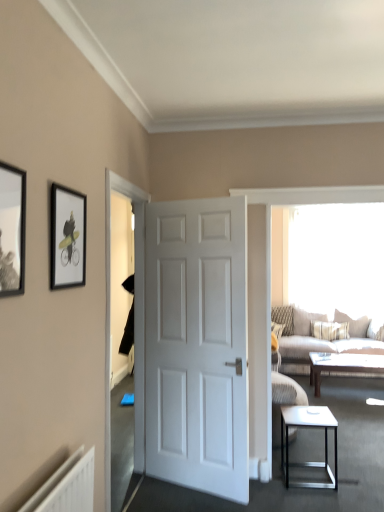
What is the approximate height of matte black picture frame at upper left, which is the 1th picture frame in right-to-left order?

It is 17.47 inches.

Describe the element at coordinates (318, 338) in the screenshot. This screenshot has height=512, width=384. I see `textured beige fabric couch at right` at that location.

Looking at this image, how much space does striped fabric pillow at right, placed as the 1th pillow when sorted from right to left, occupy vertically?

24.23 inches.

The image size is (384, 512). In order to click on matte black picture frame at left, acting as the first picture frame starting from the left in this screenshot , I will do `click(12, 230)`.

Can you tell me how much matte black picture frame at upper left, marked as the second picture frame in a left-to-right arrangement, and patterned fabric pillow at right, acting as the third pillow starting from the right, differ in facing direction?

93.6 degrees.

Between matte black picture frame at upper left, the first picture frame when ordered from back to front, and patterned fabric pillow at right, acting as the first pillow starting from the left, which one appears on the left side from the viewer's perspective?

matte black picture frame at upper left, the first picture frame when ordered from back to front.

Can you confirm if matte black picture frame at upper left, acting as the 2th picture frame starting from the front, is shorter than patterned fabric pillow at right, acting as the third pillow starting from the right?

Yes, matte black picture frame at upper left, acting as the 2th picture frame starting from the front, is shorter than patterned fabric pillow at right, acting as the third pillow starting from the right.

Would you say matte black picture frame at upper left, the first picture frame when ordered from back to front, is a long distance from patterned fabric pillow at right, acting as the first pillow starting from the left?

matte black picture frame at upper left, the first picture frame when ordered from back to front, is far away from patterned fabric pillow at right, acting as the first pillow starting from the left.

Is white glossy side table at lower right positioned far away from beige textured pillow at right, the 2th pillow in the right-to-left sequence?

Yes, white glossy side table at lower right and beige textured pillow at right, the 2th pillow in the right-to-left sequence, are located far from each other.

Between white glossy side table at lower right and beige textured pillow at right, arranged as the second pillow when viewed from the left, which one appears on the right side from the viewer's perspective?

beige textured pillow at right, arranged as the second pillow when viewed from the left.

In terms of height, does white glossy side table at lower right look taller or shorter compared to beige textured pillow at right, the 2th pillow in the right-to-left sequence?

In the image, white glossy side table at lower right appears to be shorter than beige textured pillow at right, the 2th pillow in the right-to-left sequence.

Is the depth of brown wooden coffee table at center greater than that of matte black picture frame at upper left, acting as the 2th picture frame starting from the front?

That is True.

Does brown wooden coffee table at center turn towards matte black picture frame at upper left, the first picture frame when ordered from back to front?

No, brown wooden coffee table at center is not aimed at matte black picture frame at upper left, the first picture frame when ordered from back to front.

In terms of width, does brown wooden coffee table at center look wider or thinner when compared to matte black picture frame at upper left, acting as the 2th picture frame starting from the front?

Considering their sizes, brown wooden coffee table at center looks broader than matte black picture frame at upper left, acting as the 2th picture frame starting from the front.

In the scene shown: Can you tell me how much brown wooden coffee table at center and matte black picture frame at upper left, the first picture frame when ordered from back to front, differ in facing direction?

92.6 degrees.

Is matte black picture frame at left, acting as the first picture frame starting from the left, at the back of beige textured pillow at right, arranged as the second pillow when viewed from the left?

No, matte black picture frame at left, acting as the first picture frame starting from the left, is not at the back of beige textured pillow at right, arranged as the second pillow when viewed from the left.

From a real-world perspective, between beige textured pillow at right, arranged as the second pillow when viewed from the left, and matte black picture frame at left, the second picture frame from the right, who is vertically higher?

matte black picture frame at left, the second picture frame from the right, from a real-world perspective.

Is beige textured pillow at right, arranged as the second pillow when viewed from the left, at the left side of matte black picture frame at left, acting as the first picture frame starting from the left?

In fact, beige textured pillow at right, arranged as the second pillow when viewed from the left, is to the right of matte black picture frame at left, acting as the first picture frame starting from the left.

From the image's perspective, is beige textured pillow at right, the 2th pillow in the right-to-left sequence, positioned above or below matte black picture frame at left, the second picture frame from the right?

Based on their image positions, beige textured pillow at right, the 2th pillow in the right-to-left sequence, is located beneath matte black picture frame at left, the second picture frame from the right.

Is white glossy side table at lower right further to the viewer compared to matte black picture frame at upper left, marked as the second picture frame in a left-to-right arrangement?

Yes, white glossy side table at lower right is further from the viewer.

Does white glossy side table at lower right appear on the left side of matte black picture frame at upper left, the first picture frame when ordered from back to front?

No, white glossy side table at lower right is not to the left of matte black picture frame at upper left, the first picture frame when ordered from back to front.

Does white glossy side table at lower right have a lesser width compared to matte black picture frame at upper left, the first picture frame when ordered from back to front?

In fact, white glossy side table at lower right might be wider than matte black picture frame at upper left, the first picture frame when ordered from back to front.

Who is shorter, white glossy side table at lower right or matte black picture frame at upper left, marked as the second picture frame in a left-to-right arrangement?

Standing shorter between the two is matte black picture frame at upper left, marked as the second picture frame in a left-to-right arrangement.

From the image's perspective, which is above, white glossy side table at lower right or patterned fabric pillow at right, acting as the third pillow starting from the right?

patterned fabric pillow at right, acting as the third pillow starting from the right, appears higher in the image.

Which object is closer to the camera, white glossy side table at lower right or patterned fabric pillow at right, acting as the third pillow starting from the right?

white glossy side table at lower right is in front.

Is point (333, 483) more distant than point (289, 329)?

No, (333, 483) is closer to viewer.

Looking at this image, considering the positions of objects white glossy side table at lower right and patterned fabric pillow at right, acting as the first pillow starting from the left, in the image provided, who is more to the right, white glossy side table at lower right or patterned fabric pillow at right, acting as the first pillow starting from the left,?

Positioned to the right is patterned fabric pillow at right, acting as the first pillow starting from the left.

From the image's perspective, which one is positioned higher, patterned fabric pillow at right, acting as the first pillow starting from the left, or textured beige fabric couch at right?

From the image's view, patterned fabric pillow at right, acting as the first pillow starting from the left, is above.

From a real-world perspective, between patterned fabric pillow at right, acting as the first pillow starting from the left, and textured beige fabric couch at right, who is vertically higher?

patterned fabric pillow at right, acting as the first pillow starting from the left.

In the image, is patterned fabric pillow at right, acting as the third pillow starting from the right, positioned in front of or behind textured beige fabric couch at right?

patterned fabric pillow at right, acting as the third pillow starting from the right, is positioned farther from the viewer than textured beige fabric couch at right.

Locate an element on the screen. The image size is (384, 512). pillow that is the 3rd object located behind the matte black picture frame at upper left, the first picture frame when ordered from back to front is located at coordinates (284, 318).

The height and width of the screenshot is (512, 384). I want to click on table on the left of beige textured pillow at right, the 2th pillow in the right-to-left sequence, so click(x=309, y=426).

Considering their positions, is matte black picture frame at upper left, acting as the 2th picture frame starting from the front, positioned closer to patterned fabric pillow at right, acting as the first pillow starting from the left, than white glossy side table at lower right?

white glossy side table at lower right is positioned closer to the anchor patterned fabric pillow at right, acting as the first pillow starting from the left.

Based on their spatial positions, is striped fabric pillow at right, placed as the 1th pillow when sorted from right to left, or patterned fabric pillow at right, acting as the third pillow starting from the right, further from transparent glass window screen at upper right?

patterned fabric pillow at right, acting as the third pillow starting from the right, is positioned further to the anchor transparent glass window screen at upper right.

Based on their spatial positions, is matte black picture frame at upper left, marked as the second picture frame in a left-to-right arrangement, or textured beige fabric couch at right closer to white glossy side table at lower right?

Among the two, textured beige fabric couch at right is located nearer to white glossy side table at lower right.

Estimate the real-world distances between objects in this image. Which object is further from white glossy door at center, patterned fabric pillow at right, acting as the first pillow starting from the left, or brown wooden coffee table at center?

patterned fabric pillow at right, acting as the first pillow starting from the left.

Considering their positions, is matte black picture frame at upper left, acting as the 2th picture frame starting from the front, positioned further to brown wooden coffee table at center than patterned fabric pillow at right, acting as the third pillow starting from the right?

Among the two, matte black picture frame at upper left, acting as the 2th picture frame starting from the front, is located further to brown wooden coffee table at center.

Looking at the image, which one is located further to brown wooden coffee table at center, striped fabric pillow at right, placed as the 1th pillow when sorted from right to left, or matte black picture frame at left, the second picture frame from the right?

The object further to brown wooden coffee table at center is matte black picture frame at left, the second picture frame from the right.

Based on their spatial positions, is transparent glass window screen at upper right or white glossy door at center closer to matte black picture frame at left, the second picture frame from the right?

white glossy door at center is closer to matte black picture frame at left, the second picture frame from the right.

Based on their spatial positions, is white glossy side table at lower right or striped fabric pillow at right, placed as the 1th pillow when sorted from right to left, closer to matte black picture frame at left, the second picture frame from the right?

white glossy side table at lower right is closer to matte black picture frame at left, the second picture frame from the right.

Find the location of a particular element. studio couch positioned between white glossy side table at lower right and striped fabric pillow at right, the 3th pillow positioned from the left, from near to far is located at coordinates (318, 338).

You are a GUI agent. You are given a task and a screenshot of the screen. Output one action in this format:
    pyautogui.click(x=<x>, y=<y>)
    Task: Click on the studio couch between matte black picture frame at left, the 1th picture frame in the front-to-back sequence, and beige textured pillow at right, the 2th pillow in the right-to-left sequence, from front to back
    The image size is (384, 512).
    Given the screenshot: What is the action you would take?
    pyautogui.click(x=318, y=338)

Locate an element on the screen. The image size is (384, 512). pillow located between patterned fabric pillow at right, acting as the first pillow starting from the left, and striped fabric pillow at right, placed as the 1th pillow when sorted from right to left, in the left-right direction is located at coordinates (306, 320).

At what (x,y) coordinates should I click in order to perform the action: click on coffee table positioned between matte black picture frame at upper left, acting as the 2th picture frame starting from the front, and beige textured pillow at right, arranged as the second pillow when viewed from the left, from near to far. Please return your answer as a coordinate pair (x, y). Looking at the image, I should click on (342, 365).